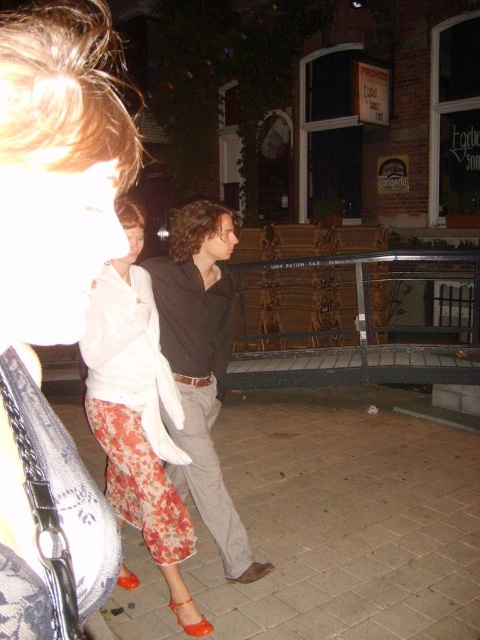
Question: Can you confirm if smooth concrete pavement at center is positioned above floral fabric pants at lower left?

Choices:
 (A) no
 (B) yes

Answer: (A)

Question: Which of the following is the farthest from the observer?

Choices:
 (A) dark brown leather jacket at center
 (B) smooth concrete pavement at center

Answer: (A)

Question: Based on their relative distances, which object is nearer to the floral fabric pants at lower left?

Choices:
 (A) smooth concrete pavement at center
 (B) dark brown leather jacket at center

Answer: (B)

Question: Which point appears closest to the camera in this image?

Choices:
 (A) (242, 468)
 (B) (156, 300)
 (C) (92, 432)
 (D) (115, 157)

Answer: (D)

Question: Considering the relative positions of floral fabric pants at center and dark brown leather jacket at center in the image provided, where is floral fabric pants at center located with respect to dark brown leather jacket at center?

Choices:
 (A) below
 (B) above

Answer: (A)

Question: Is smooth concrete pavement at center thinner than floral fabric pants at center?

Choices:
 (A) yes
 (B) no

Answer: (B)